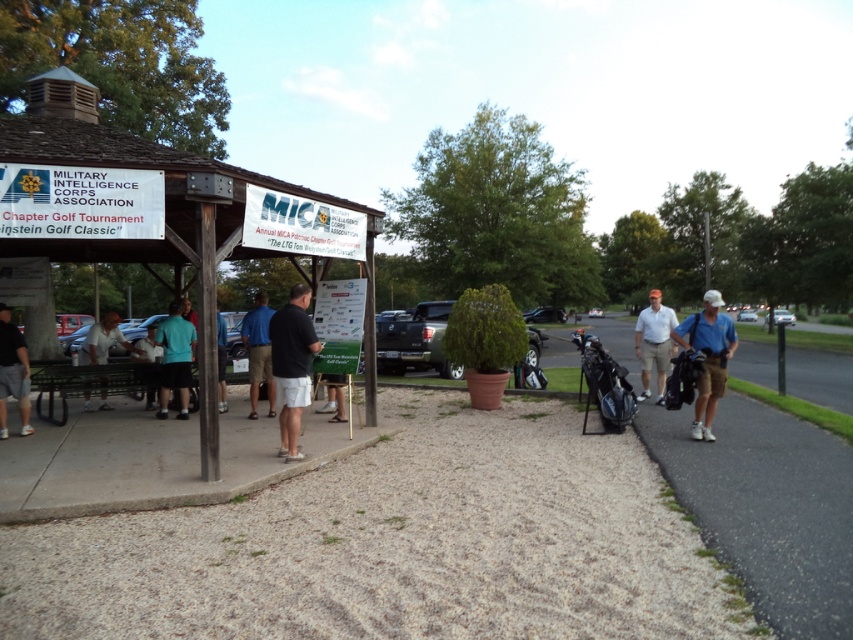
Does dark gray pants at left have a larger size compared to light blue shirt at center?

Incorrect, dark gray pants at left is not larger than light blue shirt at center.

Is point (19, 392) behind point (148, 369)?

No.

Between point (25, 355) and point (151, 381), which one is positioned in front?

Point (25, 355) is more forward.

Locate an element on the screen. The image size is (853, 640). dark gray pants at left is located at coordinates (12, 372).

Is point (283, 340) farther from camera compared to point (653, 332)?

No.

You are a GUI agent. You are given a task and a screenshot of the screen. Output one action in this format:
    pyautogui.click(x=<x>, y=<y>)
    Task: Click on the black matte shirt at center
    This screenshot has height=640, width=853.
    Given the screenshot: What is the action you would take?
    pyautogui.click(x=292, y=365)

Between point (305, 362) and point (645, 368), which one is positioned behind?

Positioned behind is point (645, 368).

Locate an element on the screen. black matte shirt at center is located at coordinates (292, 365).

Does black matte shirt at center have a smaller size compared to teal matte shirt at center?

Correct, black matte shirt at center occupies less space than teal matte shirt at center.

Locate an element on the screen. The image size is (853, 640). black matte shirt at center is located at coordinates (292, 365).

What do you see at coordinates (292, 365) in the screenshot? The height and width of the screenshot is (640, 853). I see `black matte shirt at center` at bounding box center [292, 365].

Find the location of a particular element. Image resolution: width=853 pixels, height=640 pixels. black matte shirt at center is located at coordinates (292, 365).